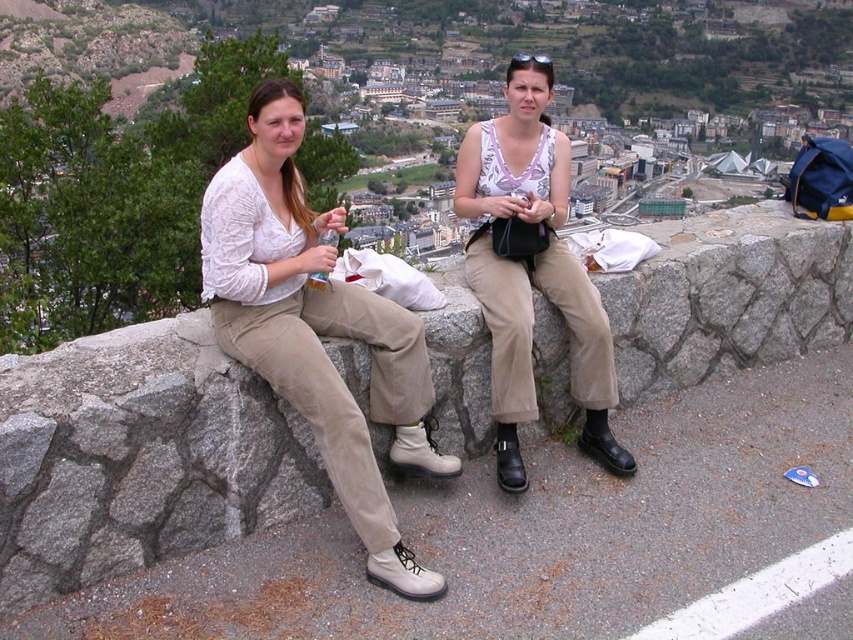
Between matte white blouse at upper center and matte white tank top at center, which one appears on the right side from the viewer's perspective?

From the viewer's perspective, matte white tank top at center appears more on the right side.

Is point (258, 93) behind point (602, 396)?

No, it is in front of (602, 396).

The height and width of the screenshot is (640, 853). I want to click on matte white blouse at upper center, so click(x=316, y=330).

Who is positioned more to the left, stone wall at center or matte white tank top at center?

From the viewer's perspective, stone wall at center appears more on the left side.

Which is below, stone wall at center or matte white tank top at center?

stone wall at center is below.

Is point (744, 211) in front of point (511, 164)?

No, it is behind (511, 164).

Identify the location of stone wall at center. Image resolution: width=853 pixels, height=640 pixels. (138, 458).

Does stone wall at center have a lesser width compared to matte white blouse at upper center?

Incorrect, stone wall at center's width is not less than matte white blouse at upper center's.

Does stone wall at center have a greater height compared to matte white blouse at upper center?

No.

Is point (666, 376) less distant than point (403, 392)?

No, (666, 376) is further to viewer.

Find the location of a particular element. The image size is (853, 640). stone wall at center is located at coordinates (138, 458).